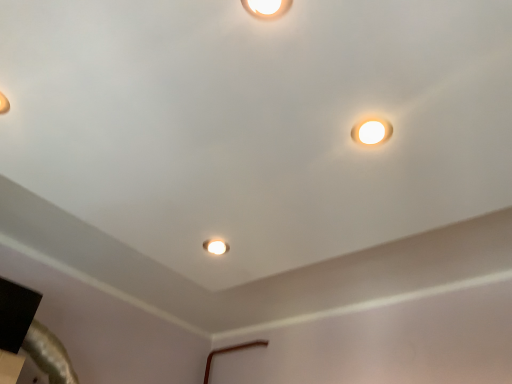
What do you see at coordinates (371, 131) in the screenshot? This screenshot has height=384, width=512. I see `matte white lamp at upper right` at bounding box center [371, 131].

The height and width of the screenshot is (384, 512). What are the coordinates of `matte white lamp at upper right` in the screenshot? It's located at (371, 131).

In order to click on matte white ceiling light at center in this screenshot , I will do coord(216,246).

The image size is (512, 384). What do you see at coordinates (216, 246) in the screenshot?
I see `matte white ceiling light at center` at bounding box center [216, 246].

The width and height of the screenshot is (512, 384). What are the coordinates of `matte white lamp at upper right` in the screenshot? It's located at (371, 131).

Considering the relative positions of matte white ceiling light at center and matte white lamp at upper right in the image provided, is matte white ceiling light at center to the left of matte white lamp at upper right from the viewer's perspective?

Yes.

Is matte white ceiling light at center positioned in front of matte white lamp at upper right?

No.

Considering the points (227, 249) and (371, 132), which point is in front, point (227, 249) or point (371, 132)?

The point (371, 132) is in front.

From the image's perspective, is matte white ceiling light at center below matte white lamp at upper right?

Yes.

From a real-world perspective, is matte white ceiling light at center below matte white lamp at upper right?

No.

Does matte white ceiling light at center have a lesser width compared to matte white lamp at upper right?

Correct, the width of matte white ceiling light at center is less than that of matte white lamp at upper right.

Considering the relative sizes of matte white ceiling light at center and matte white lamp at upper right in the image provided, is matte white ceiling light at center taller than matte white lamp at upper right?

Indeed, matte white ceiling light at center has a greater height compared to matte white lamp at upper right.

Considering the relative sizes of matte white ceiling light at center and matte white lamp at upper right in the image provided, is matte white ceiling light at center bigger than matte white lamp at upper right?

Yes.

Is matte white lamp at upper right completely or partially inside matte white ceiling light at center?

No, matte white lamp at upper right is not a part of matte white ceiling light at center.

Is matte white ceiling light at center far away from matte white lamp at upper right?

They are positioned close to each other.

Is matte white lamp at upper right at the back of matte white ceiling light at center?

No.

At what (x,y) coordinates should I click in order to perform the action: click on lamp below the matte white ceiling light at center (from a real-world perspective). Please return your answer as a coordinate pair (x, y). Looking at the image, I should click on (371, 131).

Which is more to the left, matte white lamp at upper right or matte white ceiling light at center?

Positioned to the left is matte white ceiling light at center.

Who is more distant, matte white lamp at upper right or matte white ceiling light at center?

Positioned behind is matte white ceiling light at center.

Which is nearer, (x=370, y=137) or (x=209, y=250)?

The point (x=370, y=137) is more forward.

From the image's perspective, which is above, matte white lamp at upper right or matte white ceiling light at center?

matte white lamp at upper right, from the image's perspective.

From a real-world perspective, between matte white lamp at upper right and matte white ceiling light at center, who is vertically lower?

In real-world perspective, matte white lamp at upper right is lower.

Considering the sizes of matte white lamp at upper right and matte white ceiling light at center in the image, is matte white lamp at upper right wider or thinner than matte white ceiling light at center?

Considering their sizes, matte white lamp at upper right looks broader than matte white ceiling light at center.

Considering the relative sizes of matte white lamp at upper right and matte white ceiling light at center in the image provided, is matte white lamp at upper right taller than matte white ceiling light at center?

No.

Considering the sizes of objects matte white lamp at upper right and matte white ceiling light at center in the image provided, who is bigger, matte white lamp at upper right or matte white ceiling light at center?

Bigger between the two is matte white ceiling light at center.

Is matte white lamp at upper right inside the boundaries of matte white ceiling light at center, or outside?

matte white lamp at upper right is not enclosed by matte white ceiling light at center.

Consider the image. Is matte white lamp at upper right placed right next to matte white ceiling light at center?

No, matte white lamp at upper right is not with matte white ceiling light at center.

Is matte white lamp at upper right aimed at matte white ceiling light at center?

No, matte white lamp at upper right is not turned towards matte white ceiling light at center.

What's the angular difference between matte white lamp at upper right and matte white ceiling light at center's facing directions?

The facing directions of matte white lamp at upper right and matte white ceiling light at center are 0.00124 degrees apart.

Identify the location of lamp in front of the matte white ceiling light at center. This screenshot has height=384, width=512. (371, 131).

I want to click on lamp above the matte white ceiling light at center (from the image's perspective), so click(371, 131).

The height and width of the screenshot is (384, 512). In order to click on stage light above the matte white lamp at upper right (from a real-world perspective) in this screenshot , I will do `click(216, 246)`.